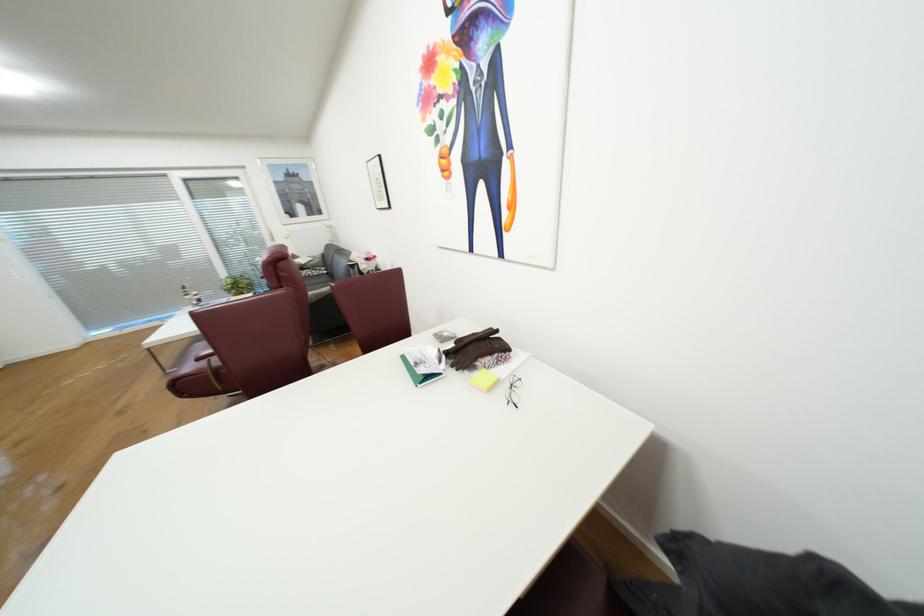
The image size is (924, 616). Identify the location of pair of eyeglasses. (513, 390).